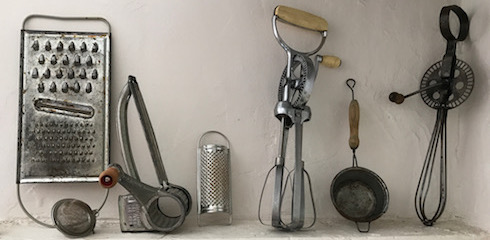
What are the coordinates of `wooden handle` in the screenshot? It's located at (112, 178), (301, 18), (330, 59), (354, 128), (399, 99).